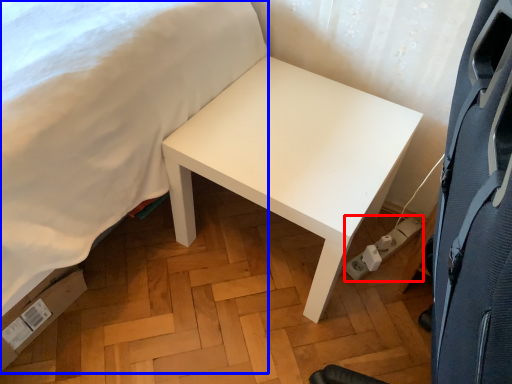
Question: Among these objects, which one is farthest to the camera, electric outlet (highlighted by a red box) or bed (highlighted by a blue box)?

Choices:
 (A) electric outlet
 (B) bed

Answer: (A)